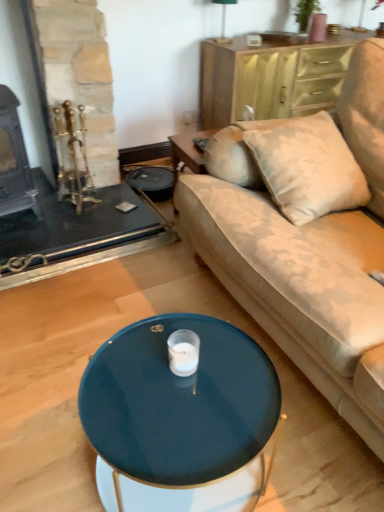
Question: Should I look upward or downward to see green fabric lampshade at upper center?

Choices:
 (A) up
 (B) down

Answer: (A)

Question: From the image's perspective, does glossy dark blue coffee table at center appear lower than wooden dresser at upper right?

Choices:
 (A) no
 (B) yes

Answer: (B)

Question: Is the position of glossy dark blue coffee table at center more distant than that of wooden dresser at upper right?

Choices:
 (A) no
 (B) yes

Answer: (A)

Question: Can you confirm if glossy dark blue coffee table at center is thinner than wooden dresser at upper right?

Choices:
 (A) yes
 (B) no

Answer: (B)

Question: Is glossy dark blue coffee table at center outside wooden dresser at upper right?

Choices:
 (A) yes
 (B) no

Answer: (A)

Question: Is glossy dark blue coffee table at center turned away from wooden dresser at upper right?

Choices:
 (A) no
 (B) yes

Answer: (A)

Question: Does glossy dark blue coffee table at center have a lesser height compared to wooden dresser at upper right?

Choices:
 (A) yes
 (B) no

Answer: (A)

Question: From a real-world perspective, is green fabric lampshade at upper center physically below velvet beige couch at center?

Choices:
 (A) no
 (B) yes

Answer: (A)

Question: Is green fabric lampshade at upper center far away from velvet beige couch at center?

Choices:
 (A) no
 (B) yes

Answer: (B)

Question: Can you confirm if green fabric lampshade at upper center is smaller than velvet beige couch at center?

Choices:
 (A) yes
 (B) no

Answer: (A)

Question: Are green fabric lampshade at upper center and velvet beige couch at center beside each other?

Choices:
 (A) yes
 (B) no

Answer: (B)

Question: Is green fabric lampshade at upper center thinner than velvet beige couch at center?

Choices:
 (A) yes
 (B) no

Answer: (A)

Question: From the image's perspective, is green fabric lampshade at upper center above velvet beige couch at center?

Choices:
 (A) yes
 (B) no

Answer: (A)

Question: Does green fabric lampshade at upper center appear on the right side of glossy dark blue coffee table at center?

Choices:
 (A) no
 (B) yes

Answer: (B)